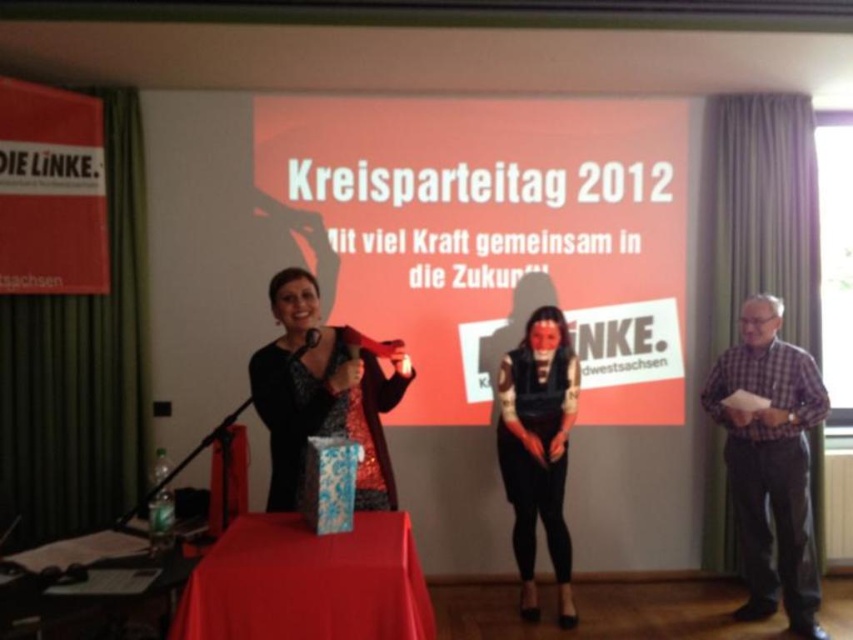
You are attending the Kreisparteitag and need to determine the relative sizes of two attendees based on their clothing. Which attendee is wearing a larger garment? The plaid fabric shirt at right or the black sequined dress at center?

The plaid fabric shirt at right is bigger than the black sequined dress at center.

What is the position of the plaid fabric shirt at right in the image?

The plaid fabric shirt at right is located at point 0.723 on the x axis and 0.904 on the y axis.